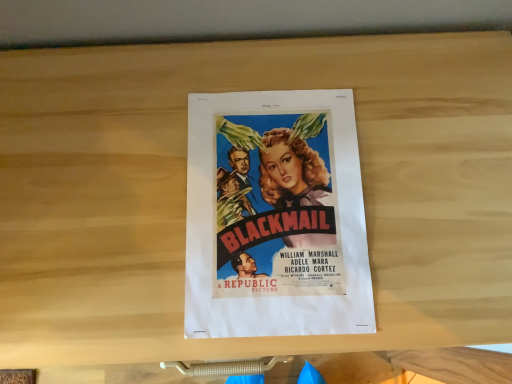
You are a GUI agent. You are given a task and a screenshot of the screen. Output one action in this format:
    pyautogui.click(x=<x>, y=<y>)
    Task: Click on the vacant space in matte paper poster at center (from a real-world perspective)
    The height and width of the screenshot is (384, 512).
    Given the screenshot: What is the action you would take?
    pyautogui.click(x=276, y=210)